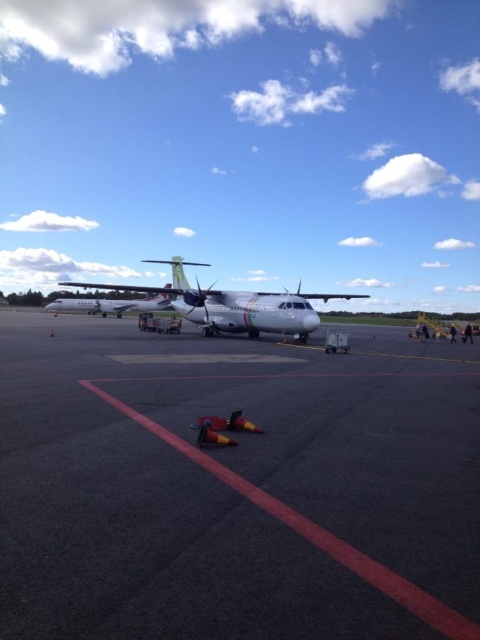
Who is more forward, [231,579] or [61,307]?

Point [231,579] is more forward.

Where is `black asphalt tarmac at center`? This screenshot has width=480, height=640. black asphalt tarmac at center is located at coordinates (235, 484).

Between point (303, 298) and point (143, 304), which one is positioned in front?

Point (303, 298) is more forward.

Can you confirm if white glossy airplane at center is wider than white matte airplane at center?

No, white glossy airplane at center is not wider than white matte airplane at center.

Locate an element on the screen. white glossy airplane at center is located at coordinates (232, 305).

Based on the photo, between black asphalt tarmac at center and white glossy airplane at center, which one appears on the right side from the viewer's perspective?

From the viewer's perspective, black asphalt tarmac at center appears more on the right side.

Image resolution: width=480 pixels, height=640 pixels. What do you see at coordinates (235, 484) in the screenshot?
I see `black asphalt tarmac at center` at bounding box center [235, 484].

Is point (80, 428) positioned behind point (194, 298)?

No, it is in front of (194, 298).

You are a GUI agent. You are given a task and a screenshot of the screen. Output one action in this format:
    pyautogui.click(x=<x>, y=<y>)
    Task: Click on the black asphalt tarmac at center
    This screenshot has width=480, height=640.
    Given the screenshot: What is the action you would take?
    pyautogui.click(x=235, y=484)